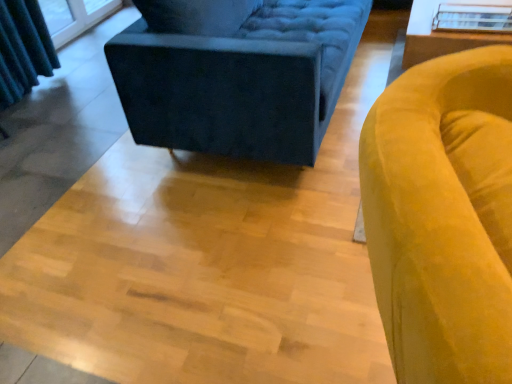
Question: Looking at their shapes, would you say white glossy table at upper right is wider or thinner than transparent glass table at upper right?

Choices:
 (A) wide
 (B) thin

Answer: (A)

Question: From a real-world perspective, relative to transparent glass table at upper right, is white glossy table at upper right vertically above or below?

Choices:
 (A) below
 (B) above

Answer: (A)

Question: Considering the real-world distances, which object is closest to the velvet yellow armchair at right?

Choices:
 (A) white glossy table at upper right
 (B) transparent glass table at upper right
 (C) velvet dark blue studio couch at upper center

Answer: (C)

Question: Based on their relative distances, which object is nearer to the white glossy table at upper right?

Choices:
 (A) velvet yellow armchair at right
 (B) transparent glass table at upper right
 (C) velvet dark blue studio couch at upper center

Answer: (B)